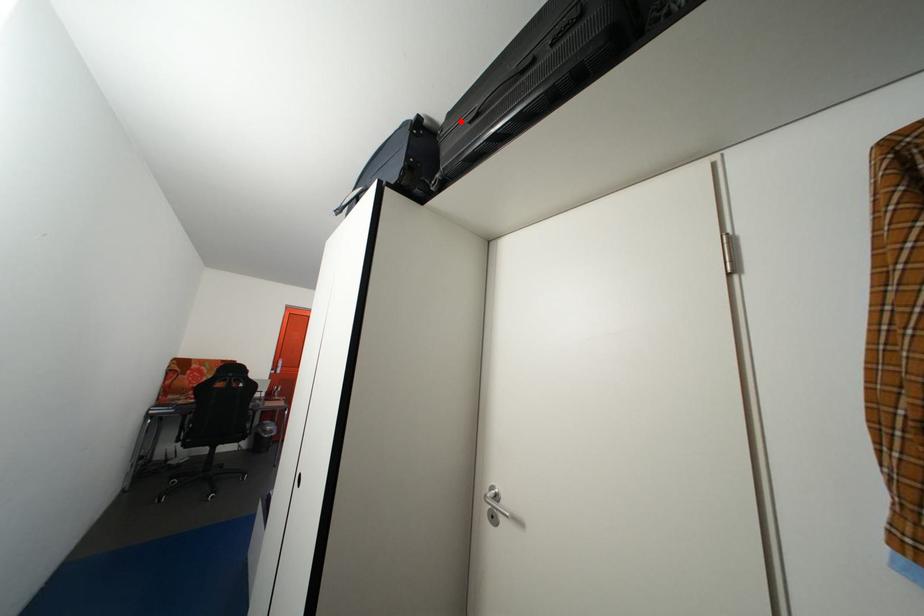
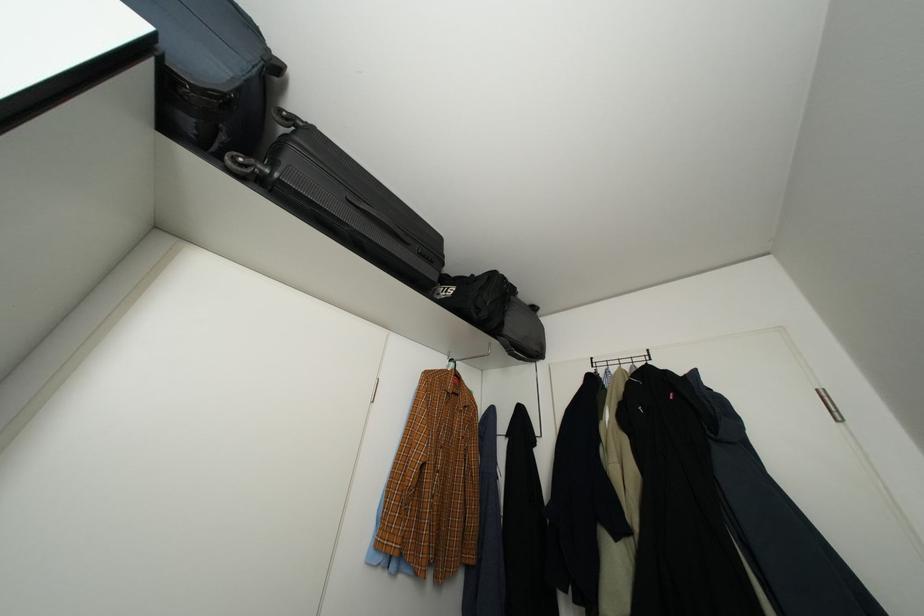
Where in the second image is the point corresponding to the highlighted location from the first image?

(323, 135)